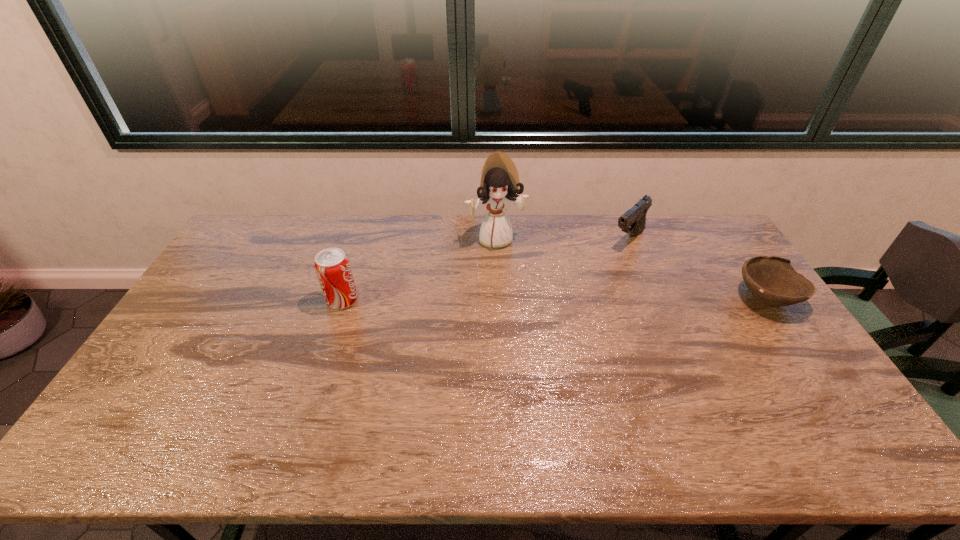
Where is `free spot at the left edge of the desktop`? This screenshot has width=960, height=540. free spot at the left edge of the desktop is located at coordinates (187, 373).

I want to click on vacant area at the right edge, so click(x=723, y=263).

You are a GUI agent. You are given a task and a screenshot of the screen. Output one action in this format:
    pyautogui.click(x=<x>, y=<y>)
    Task: Click on the vacant space at the far left corner
    The width and height of the screenshot is (960, 540).
    Given the screenshot: What is the action you would take?
    pyautogui.click(x=270, y=227)

The image size is (960, 540). I want to click on blank space at the far right corner of the desktop, so click(717, 231).

Identify the location of blank area at the near right corner. (788, 400).

At what (x,y) coordinates should I click in order to perform the action: click on free space between the rightmost object and the third object from left to right. Please return your answer as a coordinate pair (x, y). The width and height of the screenshot is (960, 540). Looking at the image, I should click on (697, 269).

In order to click on vacant space that is in between the leftmost object and the second object from left to right in this screenshot , I will do `click(419, 269)`.

I want to click on unoccupied area between the pistol and the leftmost object, so click(485, 270).

Locate an element on the screen. vacant point located between the second object from right to left and the leftmost object is located at coordinates (485, 270).

Locate an element on the screen. free space between the shortest object and the third object from left to right is located at coordinates (697, 269).